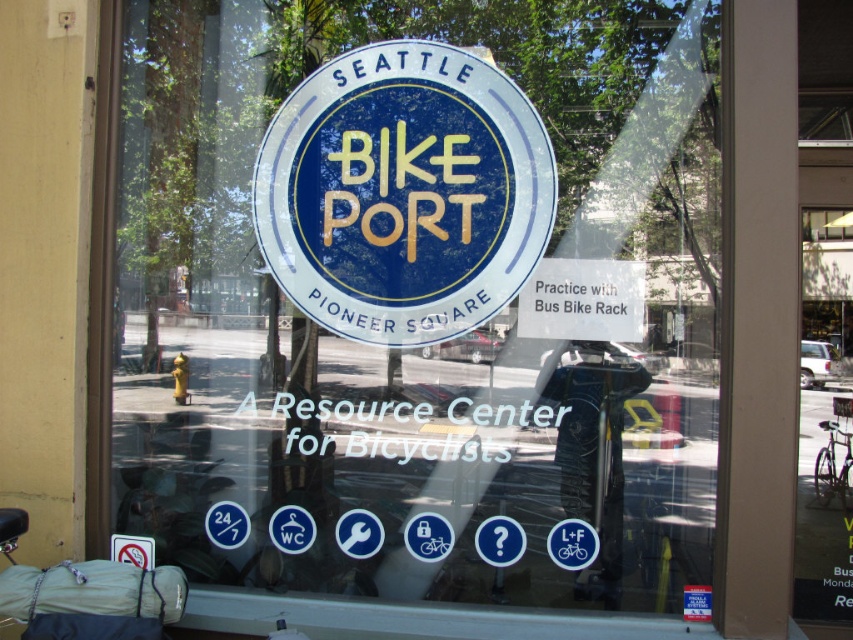
You are designing a layout for the storefront window and need to place both the blue matte sign at center and the white paper sign at center. Given their sizes, which sign should be placed first to ensure they both fit within the window space?

The blue matte sign at center has a greater width than the white paper sign at center, so you should place the blue matte sign at center first to accommodate its larger size, ensuring there is enough space left for the white paper sign at center.

You are a customer looking at the storefront window. You notice two signs at the center. Which sign is closer to you, the blue matte sign at center or the white paper sign at center?

The blue matte sign at center is closer to you because the white paper sign at center is behind it.

You are a delivery person trying to place a new sign that is 2.43 meters wide into the storefront window. The existing blue matte sign at center is already present. Can the new sign fit next to the existing one without overlapping?

The existing blue matte sign at center and the new sign are 2.43 meters apart, so the new sign can fit next to the existing one without overlapping.